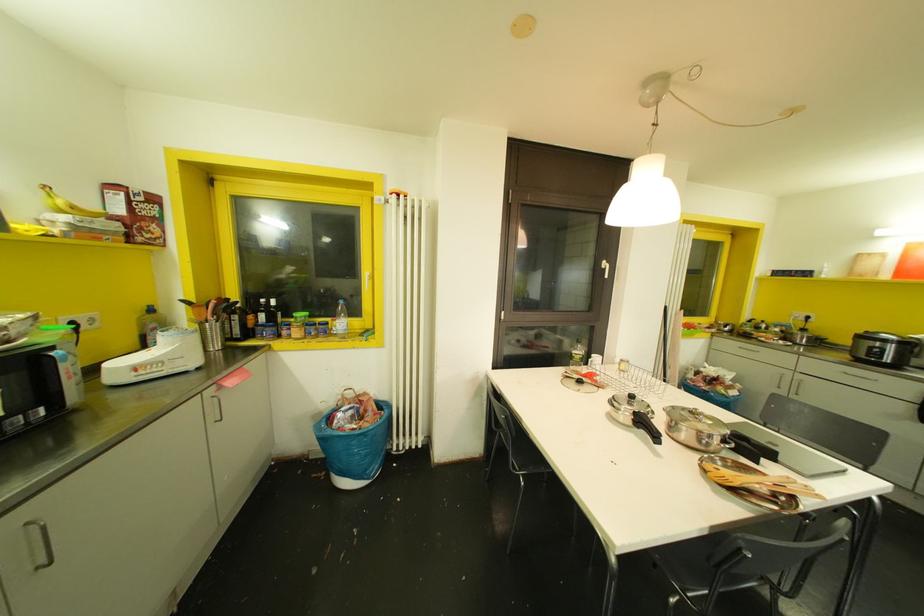
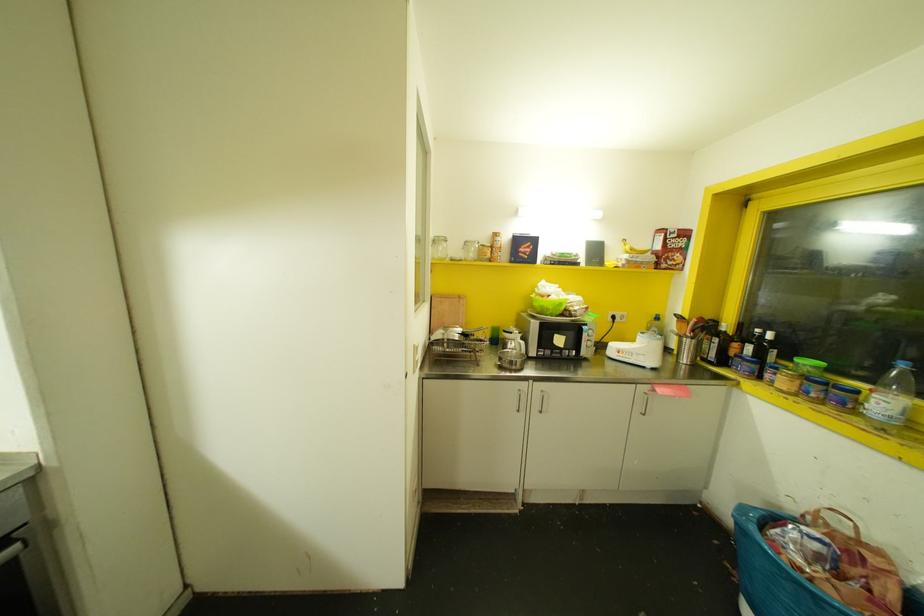
Find the pixel in the second image that matches (x=59, y=201) in the first image.

(626, 246)